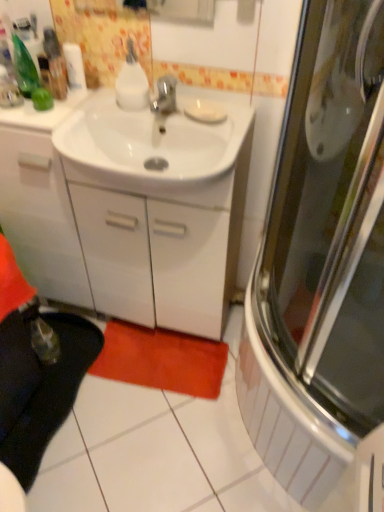
Locate an element on the screen. vacant area located to the right-hand side of translucent plastic bottle at upper left, positioned as the second bottle in right-to-left order is located at coordinates (110, 105).